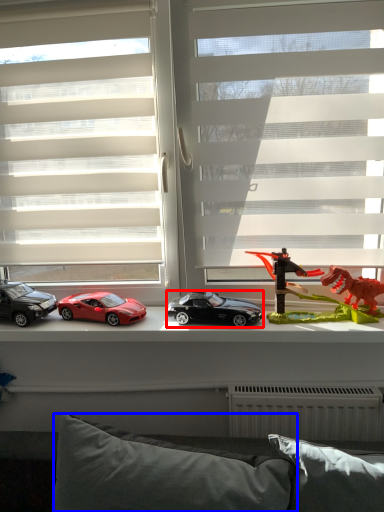
Question: Which object is closer to the camera taking this photo, car (highlighted by a red box) or pillow (highlighted by a blue box)?

Choices:
 (A) car
 (B) pillow

Answer: (B)